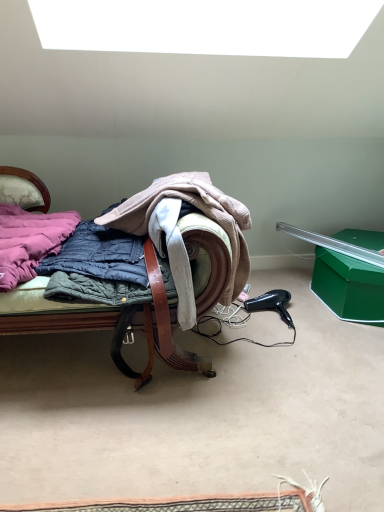
I want to click on vacant area that lies between quilted fabric chair at center and black plastic hair dryer at lower right, so click(254, 331).